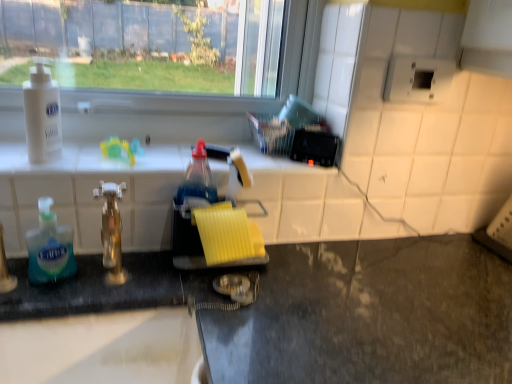
Locate an element on the screen. Image resolution: width=512 pixels, height=384 pixels. free spot above black granite counter at lower left (from a real-world perspective) is located at coordinates tap(255, 305).